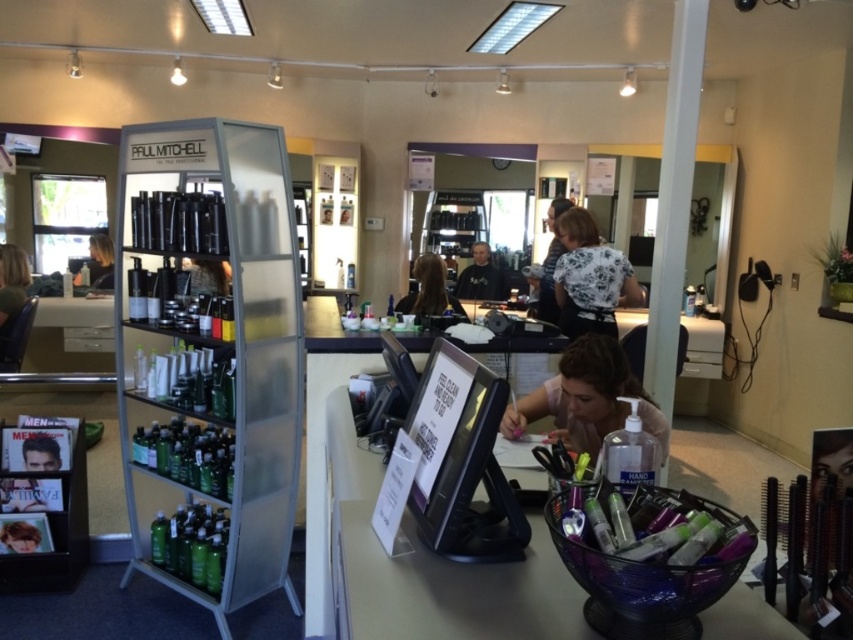
You are a customer entering the hair salon and see the white floral blouse at center and the green matte hair product at lower left. Which object is positioned more to the right side of the scene?

The white floral blouse at center is positioned more to the right side of the scene compared to the green matte hair product at lower left.

From the picture: Based on the scene description, where is the white floral blouse at center located in the image?

The white floral blouse at center is located at point (590, 278).